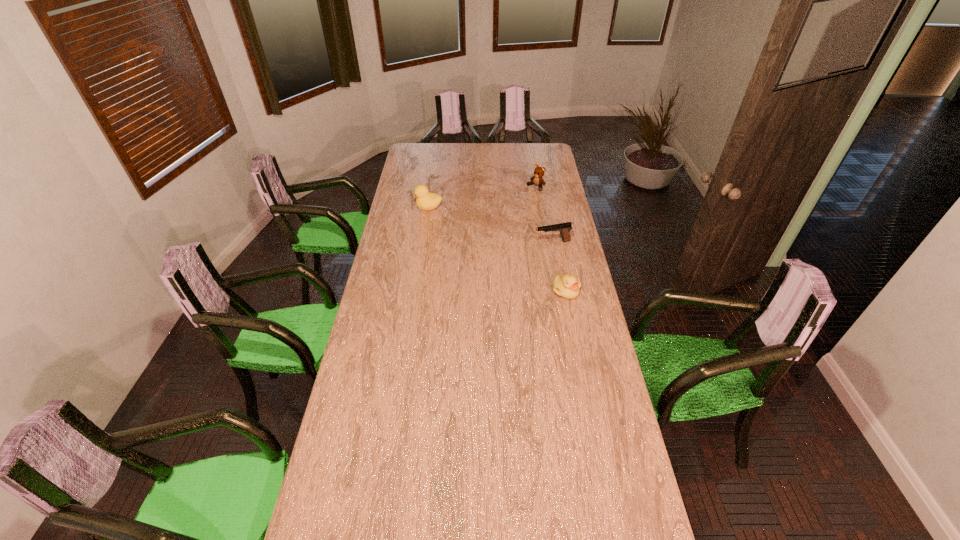
I want to click on duck, so click(425, 200).

Image resolution: width=960 pixels, height=540 pixels. What are the coordinates of `the leftmost object` in the screenshot? It's located at (425, 200).

Find the location of a particular element. This screenshot has width=960, height=540. the shortest object is located at coordinates (568, 286).

The height and width of the screenshot is (540, 960). What are the coordinates of `the nearest object` in the screenshot? It's located at (568, 286).

In order to click on teddy bear in this screenshot , I will do `click(537, 179)`.

You are a GUI agent. You are given a task and a screenshot of the screen. Output one action in this format:
    pyautogui.click(x=<x>, y=<y>)
    Task: Click on the third farthest object
    
    Given the screenshot: What is the action you would take?
    pyautogui.click(x=564, y=229)

The image size is (960, 540). What are the coordinates of `vacant space located 0.090m on the front-facing side of the leftmost object` in the screenshot? It's located at (397, 208).

Find the location of a particular element. vacant space located 0.110m on the front-facing side of the nearest object is located at coordinates (572, 321).

Locate an element on the screen. This screenshot has width=960, height=540. free location located on the front-facing side of the farthest object is located at coordinates (504, 210).

The width and height of the screenshot is (960, 540). Find the location of `vacant space situated on the front-facing side of the farthest object`. vacant space situated on the front-facing side of the farthest object is located at coordinates (514, 203).